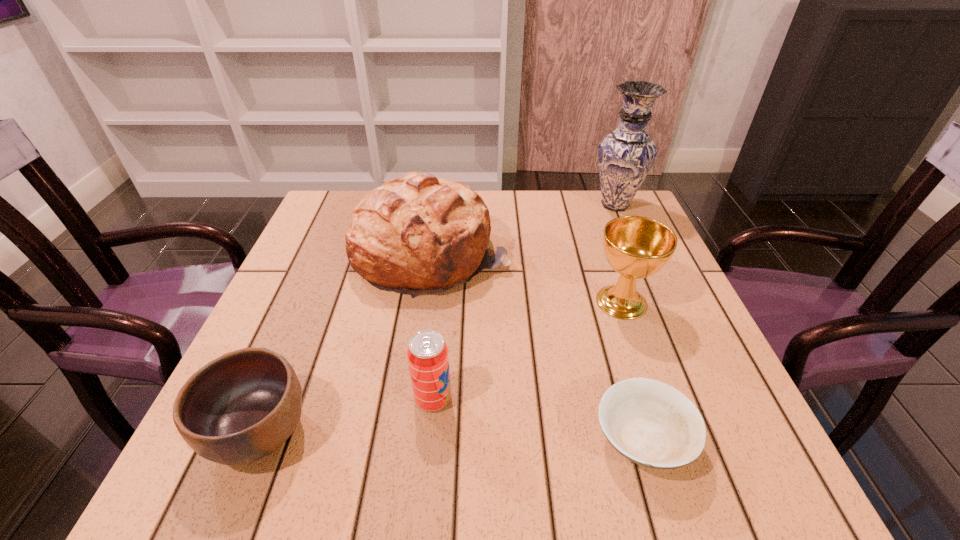
This screenshot has width=960, height=540. What are the coordinates of `vacant space in between the chalice and the soda can` in the screenshot? It's located at (527, 350).

Identify the location of vacant area that lies between the taller bowl and the vase. (438, 318).

Identify which object is the second nearest to the fourth tallest object. Please provide its 2D coordinates. Your answer should be formatted as a tuple, i.e. [(x, y)], where the tuple contains the x and y coordinates of a point satisfying the conditions above.

[(415, 234)]

Locate which object ranks fifth in proximity to the vase. Please provide its 2D coordinates. Your answer should be formatted as a tuple, i.e. [(x, y)], where the tuple contains the x and y coordinates of a point satisfying the conditions above.

[(242, 406)]

Find the location of a particular element. free point that satisfies the following two spatial constraints: 1. on the back side of the tallest object; 2. on the right side of the chalice is located at coordinates (588, 205).

The width and height of the screenshot is (960, 540). What are the coordinates of `vacant position in the image that satisfies the following two spatial constraints: 1. on the back side of the tallest object; 2. on the left side of the chalice` in the screenshot? It's located at (588, 205).

Find the location of a particular element. The height and width of the screenshot is (540, 960). blank area in the image that satisfies the following two spatial constraints: 1. on the back side of the taller bowl; 2. on the left side of the chalice is located at coordinates (312, 302).